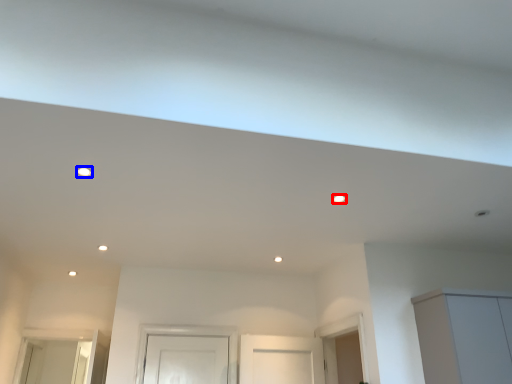
Question: Which object is closer to the camera taking this photo, lighting (highlighted by a red box) or lighting (highlighted by a blue box)?

Choices:
 (A) lighting
 (B) lighting

Answer: (B)